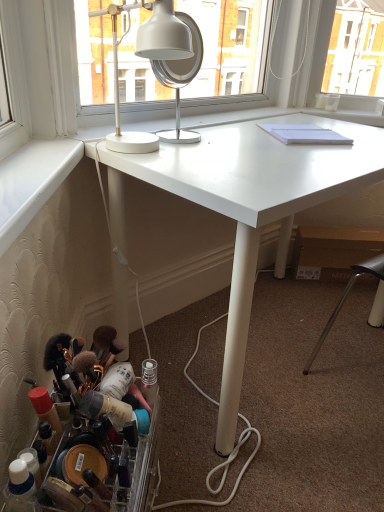
Question: From the image's perspective, is translucent plastic container at lower left above or below white glossy desk lamp at upper center?

Choices:
 (A) above
 (B) below

Answer: (B)

Question: Considering the relative positions of translucent plastic container at lower left and white glossy desk lamp at upper center in the image provided, is translucent plastic container at lower left to the left or to the right of white glossy desk lamp at upper center?

Choices:
 (A) left
 (B) right

Answer: (A)

Question: Based on their relative distances, which object is nearer to the white metallic mirror at upper center?

Choices:
 (A) white matte desk at center
 (B) translucent plastic container at lower left
 (C) white glossy desk lamp at upper center

Answer: (C)

Question: Estimate the real-world distances between objects in this image. Which object is farther from the white matte desk at center?

Choices:
 (A) translucent plastic container at lower left
 (B) white metallic mirror at upper center
 (C) white glossy desk lamp at upper center

Answer: (A)